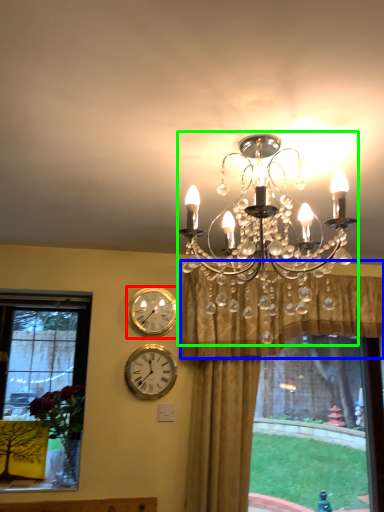
Question: Based on their relative distances, which object is nearer to wall clock (highlighted by a red box)? Choose from curtain (highlighted by a blue box) and lamp (highlighted by a green box).

Choices:
 (A) curtain
 (B) lamp

Answer: (A)